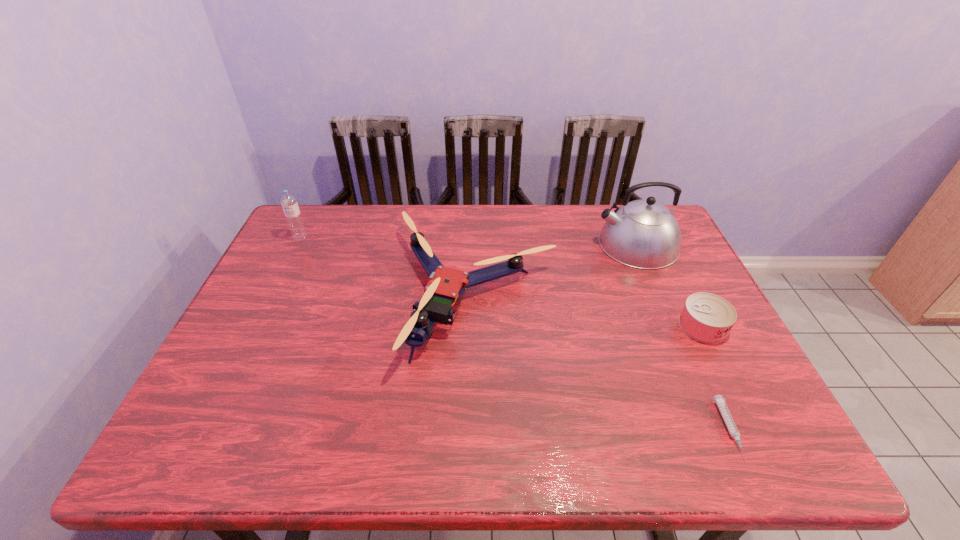
Locate an element on the screen. object that is the second closest to the fourth object from right to left is located at coordinates (719, 400).

The height and width of the screenshot is (540, 960). I want to click on vacant area that satisfies the following two spatial constraints: 1. on the front side of the fourth tallest object; 2. on the left side of the third tallest object, so click(x=475, y=327).

At what (x,y) coordinates should I click in order to perform the action: click on free region that satisfies the following two spatial constraints: 1. on the back side of the can; 2. from the spout of the tallest object. Please return your answer as a coordinate pair (x, y). The image size is (960, 540). Looking at the image, I should click on (661, 244).